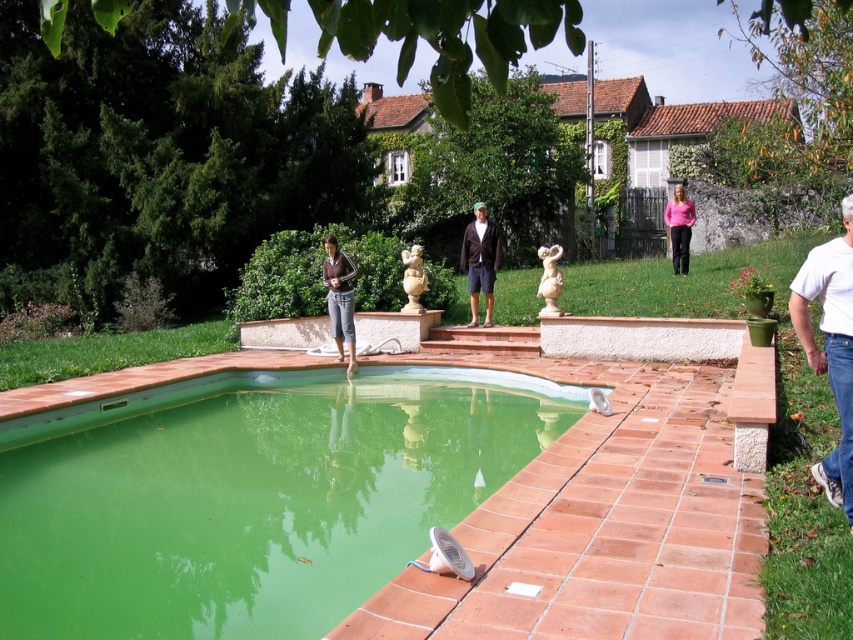
Based on the photo, you are a drone operator tasked with capturing aerial footage of the backyard. You need to ensure that both the green concrete pool at lower left and the pink fabric shirt at upper right are visible in the same frame. Given that your camera has a maximum horizontal field of view of 10 meters, can you confirm if both objects will fit within the camera frame?

The green concrete pool at lower left and pink fabric shirt at upper right are 11.09 meters apart from each other. Since the camera has a maximum horizontal field of view of 10 meters, the distance between them exceeds the camera frame capacity. Therefore, both objects cannot be captured in the same frame.

Based on the photo, you are standing in the backyard and see the green concrete pool at lower left and the pink fabric shirt at upper right. Which object is positioned further to the left?

The green concrete pool at lower left is positioned further to the left than the pink fabric shirt at upper right.